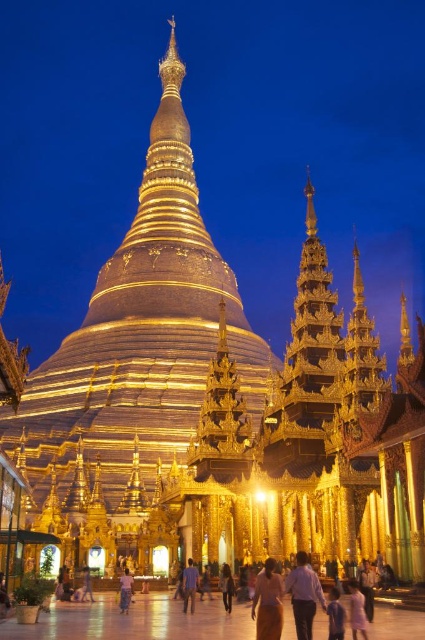
Can you confirm if purple cotton shirt at center is positioned above light brown fabric skirt at center?

Yes, purple cotton shirt at center is above light brown fabric skirt at center.

Which is behind, point (193, 576) or point (130, 595)?

Point (193, 576)

This screenshot has width=425, height=640. Identify the location of purple cotton shirt at center. (189, 586).

Who is more forward, (302, 611) or (234, 588)?

Positioned in front is point (302, 611).

Locate an element on the screen. This screenshot has width=425, height=640. purple shirt at center is located at coordinates (303, 595).

This screenshot has height=640, width=425. What do you see at coordinates (334, 616) in the screenshot?
I see `pink fabric dress at lower center` at bounding box center [334, 616].

Is pink fabric dress at lower center below purple cotton shirt at center?

Actually, pink fabric dress at lower center is above purple cotton shirt at center.

What do you see at coordinates (334, 616) in the screenshot? The image size is (425, 640). I see `pink fabric dress at lower center` at bounding box center [334, 616].

Locate an element on the screen. The width and height of the screenshot is (425, 640). pink fabric dress at lower center is located at coordinates (334, 616).